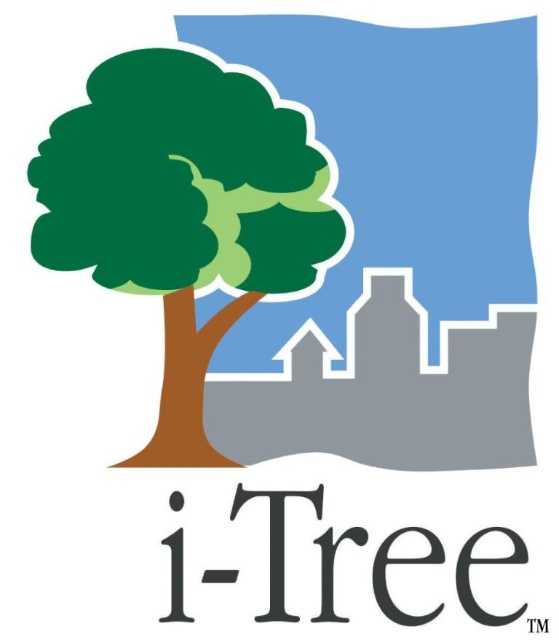
Question: Estimate the real-world distances between objects in this image. Which object is closer to the black glossy i-tree at center?

Choices:
 (A) green matte tree at center
 (B) black matte i-tree at center

Answer: (B)

Question: Considering the real-world distances, which object is closest to the green matte tree at center?

Choices:
 (A) black matte i-tree at center
 (B) black glossy i-tree at center

Answer: (A)

Question: Does green matte tree at center have a lesser width compared to black glossy i-tree at center?

Choices:
 (A) no
 (B) yes

Answer: (A)

Question: Which object is farther from the camera taking this photo?

Choices:
 (A) black matte i-tree at center
 (B) green matte tree at center

Answer: (B)

Question: Where is green matte tree at center located in relation to black glossy i-tree at center in the image?

Choices:
 (A) above
 (B) below

Answer: (A)

Question: In this image, where is green matte tree at center located relative to black glossy i-tree at center?

Choices:
 (A) below
 (B) above

Answer: (B)